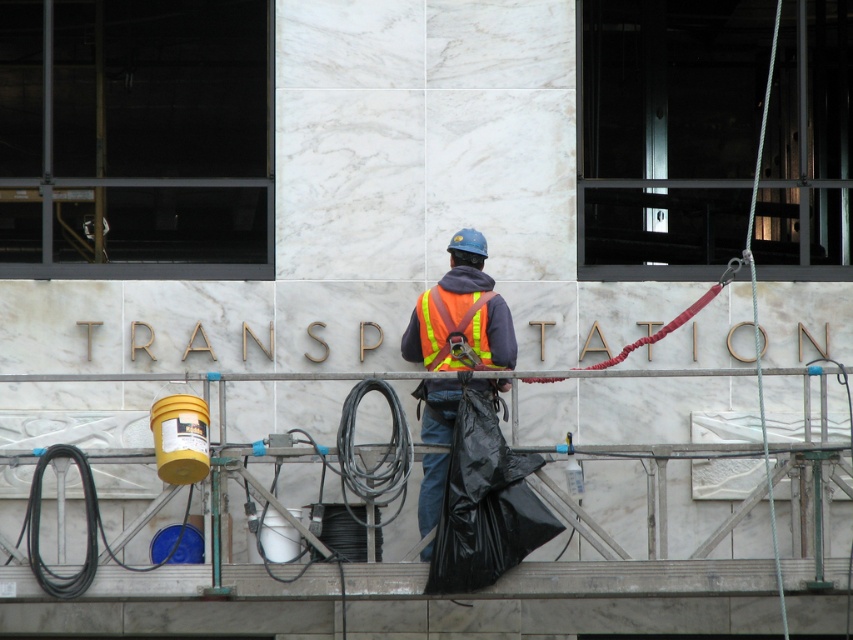
Between reflective orange safety vest at center and hi-visibility reflective safety vest at center, which one appears on the left side from the viewer's perspective?

reflective orange safety vest at center is more to the left.

Which of these two, reflective orange safety vest at center or hi-visibility reflective safety vest at center, stands taller?

reflective orange safety vest at center

Is point (440, 436) positioned in front of point (430, 339)?

Yes.

The height and width of the screenshot is (640, 853). I want to click on reflective orange safety vest at center, so click(x=461, y=312).